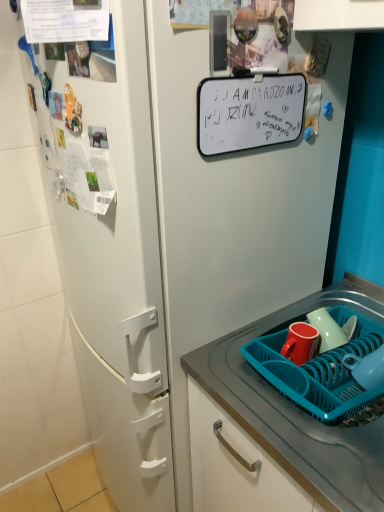
This screenshot has width=384, height=512. Describe the element at coordinates (327, 330) in the screenshot. I see `glossy ceramic mug at lower right` at that location.

This screenshot has width=384, height=512. Describe the element at coordinates (296, 407) in the screenshot. I see `teal plastic tray at lower right` at that location.

Where is `matte red mug at lower right`? Image resolution: width=384 pixels, height=512 pixels. matte red mug at lower right is located at coordinates (300, 343).

Locate an element on the screen. This screenshot has width=384, height=512. glossy ceramic mug at lower right is located at coordinates (327, 330).

Is teal plastic tray at lower right far away from matte red mug at lower right?

No, teal plastic tray at lower right is not far from matte red mug at lower right.

Can you confirm if teal plastic tray at lower right is smaller than matte red mug at lower right?

No, teal plastic tray at lower right is not smaller than matte red mug at lower right.

Can you confirm if teal plastic tray at lower right is shorter than matte red mug at lower right?

In fact, teal plastic tray at lower right may be taller than matte red mug at lower right.

Which is more to the right, teal plastic tray at lower right or matte red mug at lower right?

teal plastic tray at lower right.

Measure the distance between glossy ceramic mug at lower right and matte red mug at lower right.

glossy ceramic mug at lower right and matte red mug at lower right are 1.90 inches apart from each other.

Which object is closer to the camera, glossy ceramic mug at lower right or matte red mug at lower right?

matte red mug at lower right is in front.

Could you tell me if glossy ceramic mug at lower right is turned towards matte red mug at lower right?

Yes, glossy ceramic mug at lower right is oriented towards matte red mug at lower right.

Considering the sizes of objects glossy ceramic mug at lower right and matte red mug at lower right in the image provided, who is smaller, glossy ceramic mug at lower right or matte red mug at lower right?

matte red mug at lower right.

Considering the points (359, 348) and (269, 425), which point is in front, point (359, 348) or point (269, 425)?

The point (269, 425) is more forward.

Based on the photo, could you tell me if blue plastic basket at lower right is turned towards teal plastic tray at lower right?

Yes, blue plastic basket at lower right is turned towards teal plastic tray at lower right.

Considering the sizes of objects blue plastic basket at lower right and teal plastic tray at lower right in the image provided, who is thinner, blue plastic basket at lower right or teal plastic tray at lower right?

blue plastic basket at lower right.

In order to click on basket above the teal plastic tray at lower right (from the image's perspective) in this screenshot , I will do `click(319, 373)`.

Consider the image. Considering the relative sizes of teal plastic tray at lower right and glossy ceramic mug at lower right in the image provided, is teal plastic tray at lower right taller than glossy ceramic mug at lower right?

Yes, teal plastic tray at lower right is taller than glossy ceramic mug at lower right.

From a real-world perspective, is teal plastic tray at lower right located beneath glossy ceramic mug at lower right?

Correct, in the physical world, teal plastic tray at lower right is lower than glossy ceramic mug at lower right.

Can you confirm if teal plastic tray at lower right is positioned to the right of glossy ceramic mug at lower right?

Indeed, teal plastic tray at lower right is positioned on the right side of glossy ceramic mug at lower right.

Can you tell me how much teal plastic tray at lower right and glossy ceramic mug at lower right differ in facing direction?

0.00402 degrees.

What's the angular difference between matte red mug at lower right and glossy ceramic mug at lower right's facing directions?

The angle between the facing direction of matte red mug at lower right and the facing direction of glossy ceramic mug at lower right is 0.00259 degrees.

Does matte red mug at lower right contain glossy ceramic mug at lower right?

Definitely not — glossy ceramic mug at lower right is not inside matte red mug at lower right.

Considering the positions of point (300, 364) and point (313, 324), is point (300, 364) closer or farther from the camera than point (313, 324)?

Point (300, 364) is closer to the camera than point (313, 324).

Considering the relative positions of matte red mug at lower right and glossy ceramic mug at lower right in the image provided, is matte red mug at lower right to the left or to the right of glossy ceramic mug at lower right?

From the image, it's evident that matte red mug at lower right is to the left of glossy ceramic mug at lower right.

Does point (311, 320) appear closer or farther from the camera than point (350, 403)?

Point (311, 320) is farther from the camera than point (350, 403).

Considering the relative sizes of glossy ceramic mug at lower right and blue plastic basket at lower right in the image provided, is glossy ceramic mug at lower right wider than blue plastic basket at lower right?

In fact, glossy ceramic mug at lower right might be narrower than blue plastic basket at lower right.

How many degrees apart are the facing directions of glossy ceramic mug at lower right and blue plastic basket at lower right?

glossy ceramic mug at lower right and blue plastic basket at lower right are facing 0.336 degrees away from each other.

Find the location of a particular element. Image resolution: width=384 pixels, height=512 pixels. basket on the left of glossy ceramic mug at lower right is located at coordinates (319, 373).

Is matte red mug at lower right completely or partially outside of teal plastic tray at lower right?

No, matte red mug at lower right is not entirely external to teal plastic tray at lower right.

Looking at this image, relative to teal plastic tray at lower right, is matte red mug at lower right in front or behind?

Visually, matte red mug at lower right is located behind teal plastic tray at lower right.

The image size is (384, 512). I want to click on desk below the matte red mug at lower right (from the image's perspective), so (x=296, y=407).

From their relative heights in the image, would you say matte red mug at lower right is taller or shorter than teal plastic tray at lower right?

In the image, matte red mug at lower right appears to be shorter than teal plastic tray at lower right.

At what (x,y) coordinates should I click in order to perform the action: click on desk below the matte red mug at lower right (from a real-world perspective). Please return your answer as a coordinate pair (x, y). The width and height of the screenshot is (384, 512). Looking at the image, I should click on (296, 407).

This screenshot has width=384, height=512. Identify the location of mug behind the matte red mug at lower right. (327, 330).

Based on their spatial positions, is blue plastic basket at lower right or matte red mug at lower right closer to teal plastic tray at lower right?

blue plastic basket at lower right.

When comparing their distances from matte red mug at lower right, does glossy ceramic mug at lower right or teal plastic tray at lower right seem further?

teal plastic tray at lower right.

Considering their positions, is blue plastic basket at lower right positioned further to teal plastic tray at lower right than glossy ceramic mug at lower right?

The object further to teal plastic tray at lower right is glossy ceramic mug at lower right.

Which object lies nearer to the anchor point glossy ceramic mug at lower right, teal plastic tray at lower right or blue plastic basket at lower right?

blue plastic basket at lower right is positioned closer to the anchor glossy ceramic mug at lower right.

Looking at the image, which one is located further to glossy ceramic mug at lower right, matte red mug at lower right or teal plastic tray at lower right?

The object further to glossy ceramic mug at lower right is teal plastic tray at lower right.

In the scene shown: Estimate the real-world distances between objects in this image. Which object is closer to matte red mug at lower right, teal plastic tray at lower right or blue plastic basket at lower right?

blue plastic basket at lower right is closer to matte red mug at lower right.

From the image, which object appears to be farther from glossy ceramic mug at lower right, blue plastic basket at lower right or matte red mug at lower right?

blue plastic basket at lower right lies further to glossy ceramic mug at lower right than the other object.

Which object lies nearer to the anchor point blue plastic basket at lower right, teal plastic tray at lower right or matte red mug at lower right?

teal plastic tray at lower right is closer to blue plastic basket at lower right.

Where is `coffee cup between blue plastic basket at lower right and glossy ceramic mug at lower right in the front-back direction`? This screenshot has height=512, width=384. coffee cup between blue plastic basket at lower right and glossy ceramic mug at lower right in the front-back direction is located at coordinates (300, 343).

Find the location of a particular element. This screenshot has height=512, width=384. basket that lies between glossy ceramic mug at lower right and teal plastic tray at lower right from top to bottom is located at coordinates (319, 373).

Image resolution: width=384 pixels, height=512 pixels. Find the location of `basket between matte red mug at lower right and teal plastic tray at lower right in the vertical direction`. basket between matte red mug at lower right and teal plastic tray at lower right in the vertical direction is located at coordinates (319, 373).

Image resolution: width=384 pixels, height=512 pixels. In order to click on coffee cup between glossy ceramic mug at lower right and teal plastic tray at lower right in the up-down direction in this screenshot , I will do `click(300, 343)`.